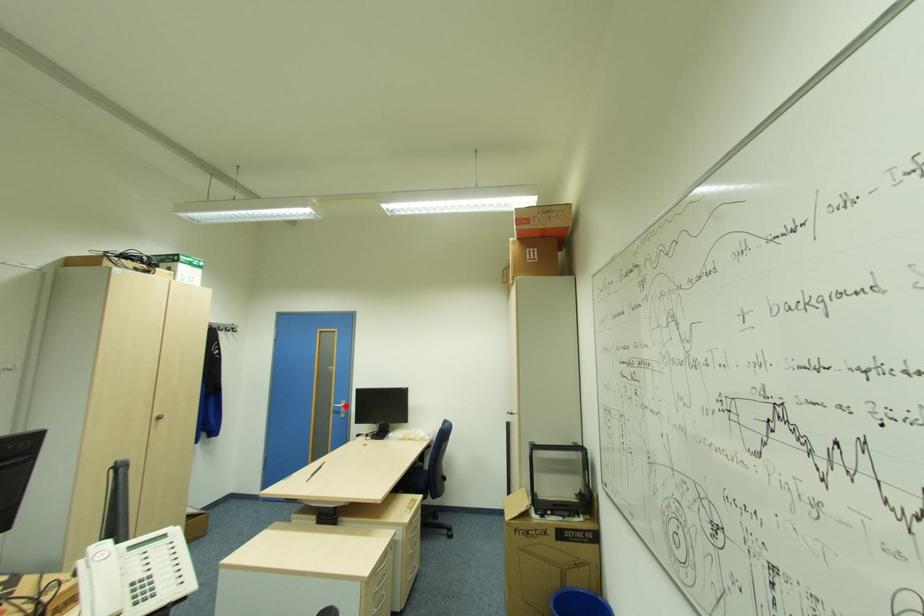
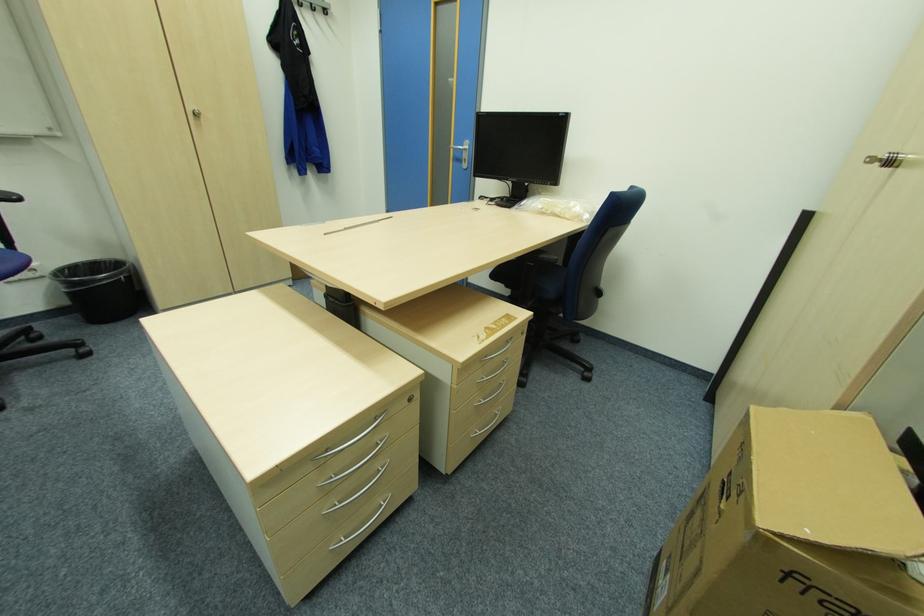
Question: I am providing you with two images of the same scene from different viewpoints. Given a red point in image1, look at the same physical point in image2. Is it:

Choices:
 (A) Closer to the viewpoint
 (B) Farther from the viewpoint

Answer: (A)